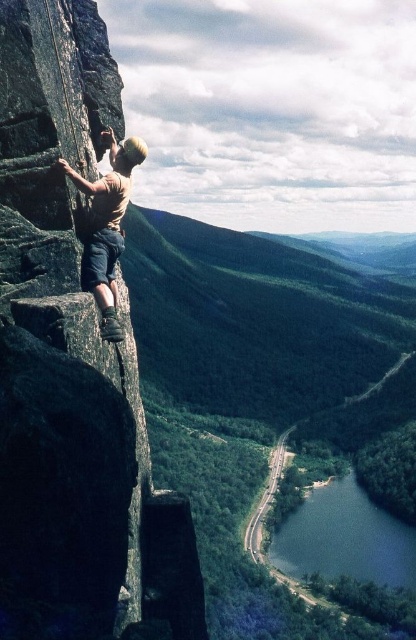
Based on the photo, is smooth gray rock at left thinner than light brown fabric shirt at left?

In fact, smooth gray rock at left might be wider than light brown fabric shirt at left.

Which is above, smooth gray rock at left or light brown fabric shirt at left?

light brown fabric shirt at left

Does point (37, 580) lie in front of point (98, 196)?

Yes.

Locate an element on the screen. This screenshot has width=416, height=640. smooth gray rock at left is located at coordinates (72, 369).